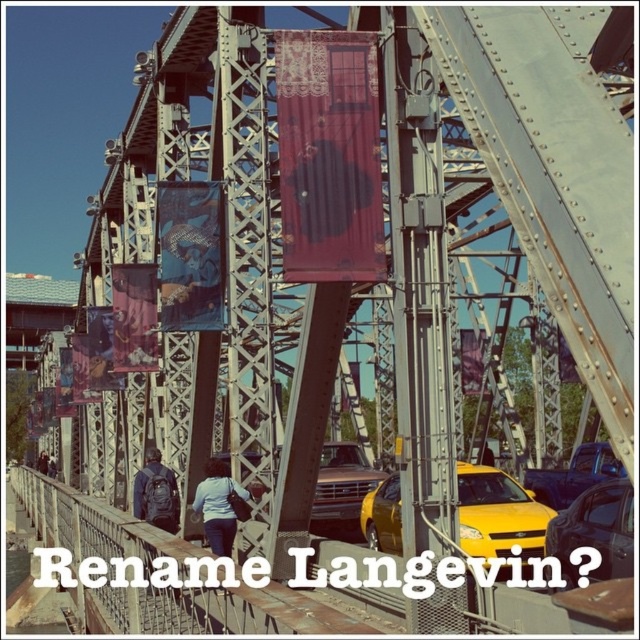
You are standing on the metal bridge and want to take a photo. There are two points on the bridge that you want to capture in your shot. The first point is at coordinate point(x=605, y=449) and the second is at point(x=340, y=460). Which point will appear larger in your photo?

Point(x=605, y=449) is closer to the camera than point(x=340, y=460), so it will appear larger in the photo.

You are a pedestrian standing on the wooden walkway of the metal bridge. You see a metallic blue truck at center and a dark gray backpack at center. Which object is closer to you?

The metallic blue truck at center is closer to you than the dark gray backpack at center.

You are standing on the bridge and see the metallic blue truck at center and the dark gray backpack at center. Which object is positioned lower from the ground?

The metallic blue truck at center is positioned below the dark gray backpack at center, so the metallic blue truck at center is lower from the ground.